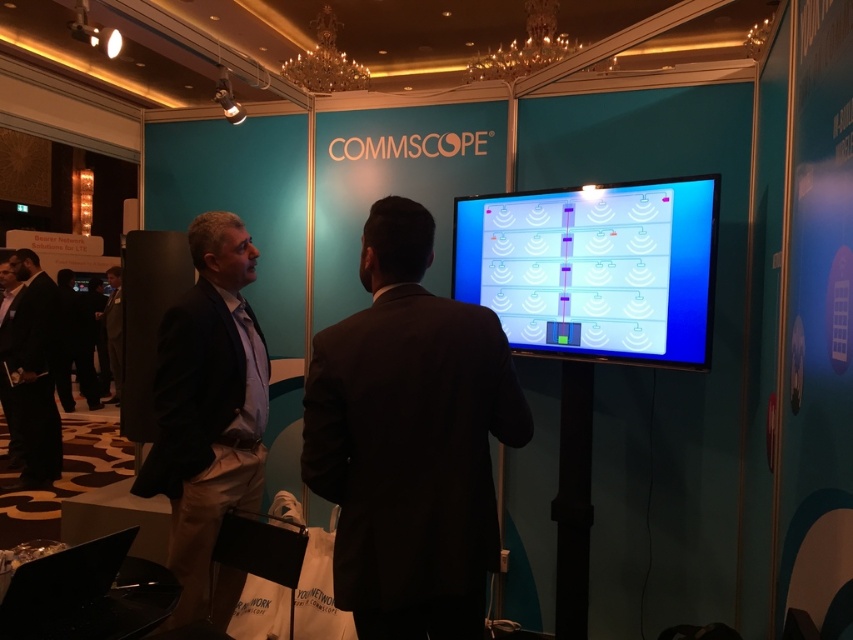
Question: Which object is closer to the camera taking this photo?

Choices:
 (A) black fabric pants at lower left
 (B) black suit at center

Answer: (B)

Question: Is black suit at center to the left of black suit at left from the viewer's perspective?

Choices:
 (A) yes
 (B) no

Answer: (B)

Question: Is black suit at center to the right of black suit at left from the viewer's perspective?

Choices:
 (A) no
 (B) yes

Answer: (B)

Question: Is black fabric pants at lower left smaller than dark suit at center?

Choices:
 (A) yes
 (B) no

Answer: (B)

Question: Which of the following is the closest to the observer?

Choices:
 (A) (16, 374)
 (B) (91, 401)
 (C) (223, 506)

Answer: (C)

Question: Which object is positioned closest to the black suit at left?

Choices:
 (A) dark brown suit at left
 (B) black suit at center

Answer: (A)